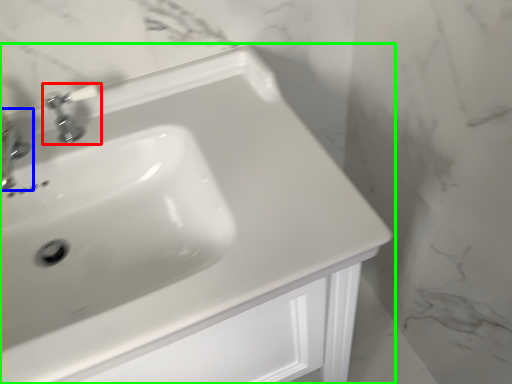
Question: Which is nearer to the tap (highlighted by a red box)? tap (highlighted by a blue box) or sink (highlighted by a green box).

Choices:
 (A) tap
 (B) sink

Answer: (A)